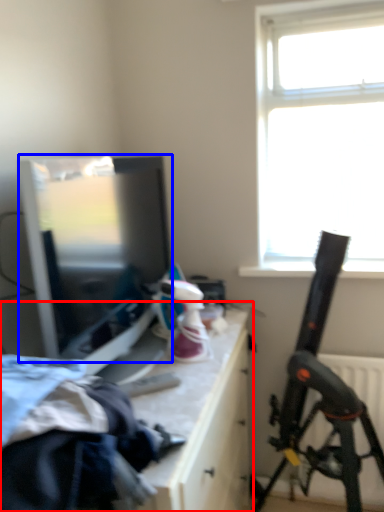
Question: Which object is closer to the camera taking this photo, table (highlighted by a red box) or window screen (highlighted by a blue box)?

Choices:
 (A) table
 (B) window screen

Answer: (A)